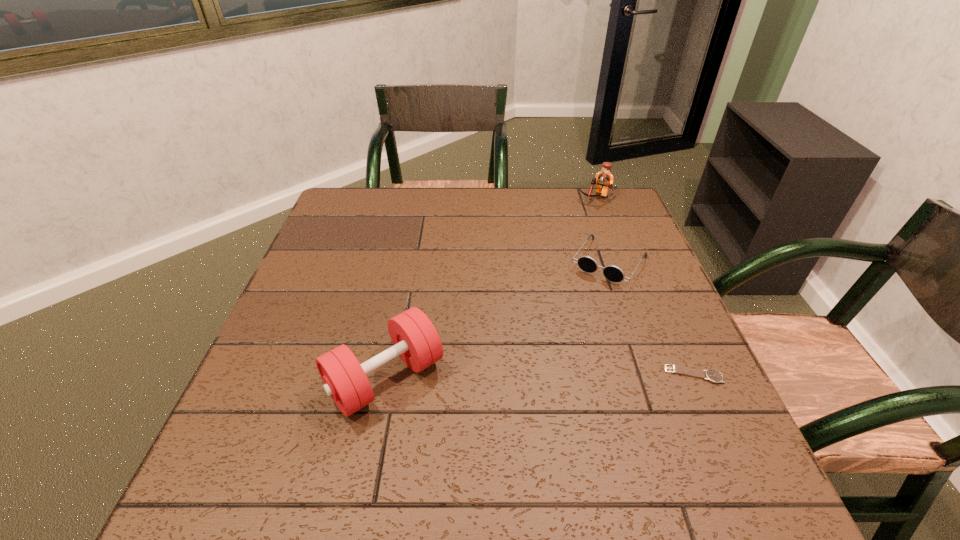
Locate an element on the screen. Image resolution: width=960 pixels, height=540 pixels. free location located 0.180m holding a crossbow in the hands of the Lego is located at coordinates (575, 235).

Identify the location of free space located holding a crossbow in the hands of the Lego. (577, 231).

At what (x,y) coordinates should I click in order to perform the action: click on free space located holding a crossbow in the hands of the Lego. Please return your answer as a coordinate pair (x, y). Looking at the image, I should click on (568, 249).

Image resolution: width=960 pixels, height=540 pixels. Find the location of `object that is positioned at the far edge`. object that is positioned at the far edge is located at coordinates (604, 179).

Where is `object located at the near edge`? This screenshot has height=540, width=960. object located at the near edge is located at coordinates (415, 339).

At what (x,y) coordinates should I click in order to perform the action: click on object that is positioned at the left edge. Please return your answer as a coordinate pair (x, y). Looking at the image, I should click on (415, 339).

You are a GUI agent. You are given a task and a screenshot of the screen. Output one action in this format:
    pyautogui.click(x=<x>, y=<y>)
    Task: Click on the watch that is at the right edge
    This screenshot has height=540, width=960.
    Given the screenshot: What is the action you would take?
    pyautogui.click(x=714, y=376)

You are a GUI agent. You are given a task and a screenshot of the screen. Output one action in this format:
    pyautogui.click(x=<x>, y=<y>)
    Task: Click on the sunglasses at the right edge
    
    Given the screenshot: What is the action you would take?
    pyautogui.click(x=613, y=273)

This screenshot has height=540, width=960. Find the location of `Lego located at the right edge`. Lego located at the right edge is located at coordinates (604, 179).

This screenshot has height=540, width=960. Identify the location of object located at the near left corner. (415, 339).